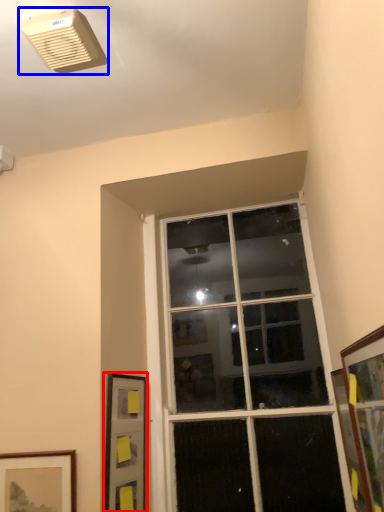
Question: Which point is closer to the camera, picture frame (highlighted by a red box) or air conditioning (highlighted by a blue box)?

Choices:
 (A) picture frame
 (B) air conditioning

Answer: (B)